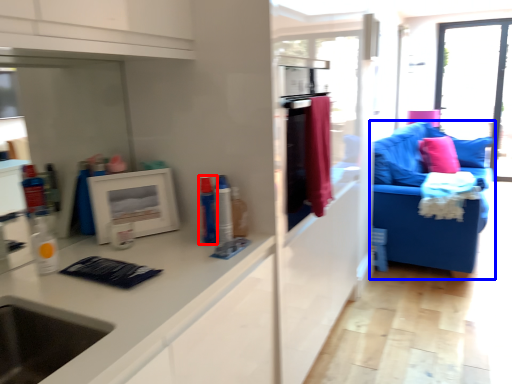
Question: Which of the following is the farthest to the observer, toiletry (highlighted by a red box) or studio couch (highlighted by a blue box)?

Choices:
 (A) toiletry
 (B) studio couch

Answer: (B)